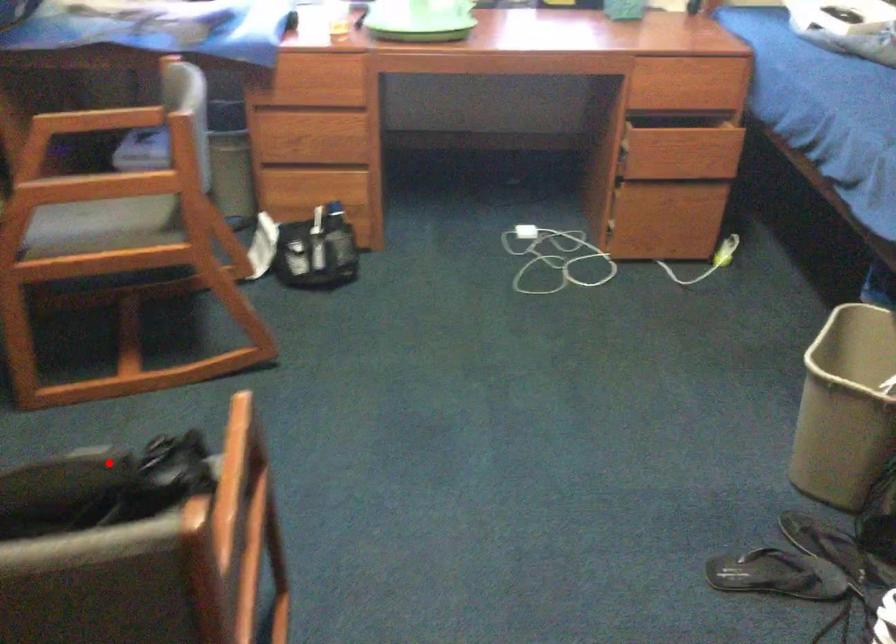
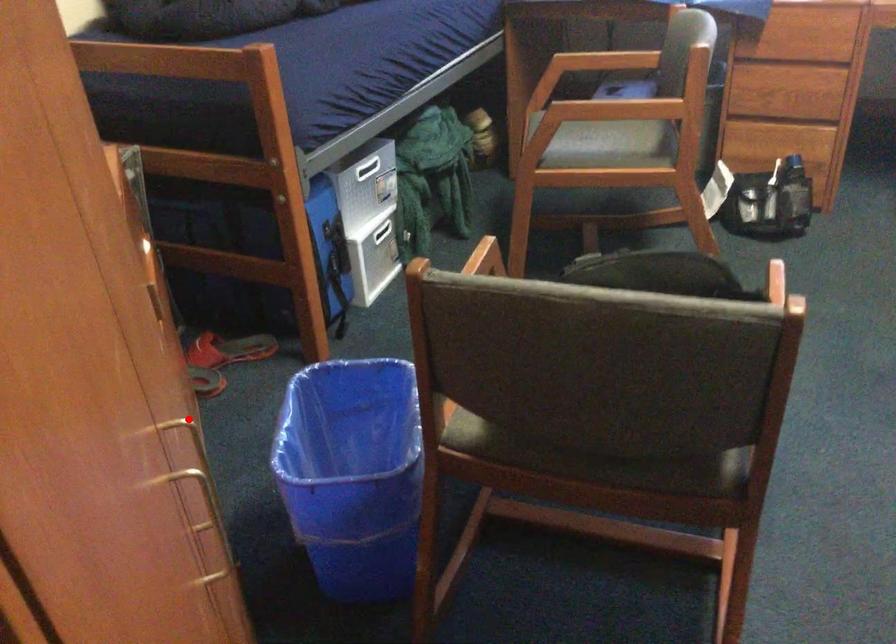
I am providing you with two images of the same scene from different viewpoints. A red point is marked on the first image and another point is marked on the second image. Are the points marked in image1 and image2 representing the same 3D position?

No